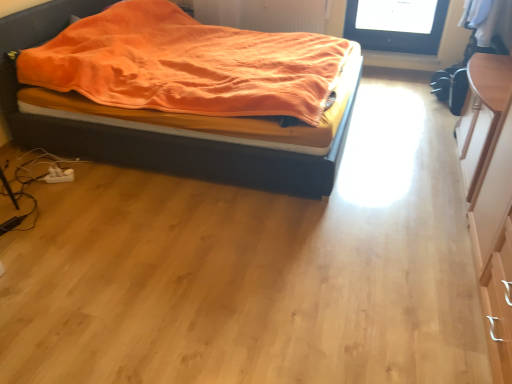
Question: Considering the relative sizes of light wood dresser at right and orange soft fabric bed at left in the image provided, is light wood dresser at right bigger than orange soft fabric bed at left?

Choices:
 (A) no
 (B) yes

Answer: (A)

Question: Is light wood dresser at right next to orange soft fabric bed at left and touching it?

Choices:
 (A) yes
 (B) no

Answer: (B)

Question: Is light wood dresser at right not close to orange soft fabric bed at left?

Choices:
 (A) no
 (B) yes

Answer: (B)

Question: Is light wood dresser at right oriented towards orange soft fabric bed at left?

Choices:
 (A) no
 (B) yes

Answer: (A)

Question: From a real-world perspective, is light wood dresser at right on top of orange soft fabric bed at left?

Choices:
 (A) no
 (B) yes

Answer: (B)

Question: Considering the relative positions of light wood dresser at right and orange soft fabric bed at left in the image provided, is light wood dresser at right to the left of orange soft fabric bed at left from the viewer's perspective?

Choices:
 (A) yes
 (B) no

Answer: (B)

Question: From the image's perspective, would you say orange soft fabric bed at left is shown under light wood dresser at right?

Choices:
 (A) no
 (B) yes

Answer: (A)

Question: Does orange soft fabric bed at left come behind light wood dresser at right?

Choices:
 (A) yes
 (B) no

Answer: (A)

Question: Is orange soft fabric bed at left with light wood dresser at right?

Choices:
 (A) yes
 (B) no

Answer: (B)

Question: Is light wood dresser at right surrounded by orange soft fabric bed at left?

Choices:
 (A) no
 (B) yes

Answer: (A)

Question: Is the position of orange soft fabric bed at left less distant than that of light wood dresser at right?

Choices:
 (A) no
 (B) yes

Answer: (A)

Question: Is orange soft fabric bed at left completely or partially outside of light wood dresser at right?

Choices:
 (A) yes
 (B) no

Answer: (A)

Question: Based on their sizes in the image, would you say light wood dresser at right is bigger or smaller than orange soft fabric bed at left?

Choices:
 (A) small
 (B) big

Answer: (A)